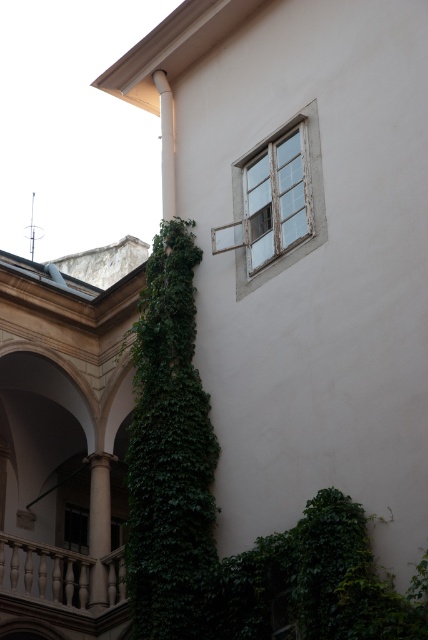
Between green leafy ivy at left and white marble balustrade at lower left, which one is positioned lower?

Positioned lower is white marble balustrade at lower left.

Can you confirm if green leafy ivy at left is shorter than white marble balustrade at lower left?

In fact, green leafy ivy at left may be taller than white marble balustrade at lower left.

Identify the location of green leafy ivy at left. (169, 454).

Can you confirm if green leafy ivy at left is taller than smooth stone column at lower left?

Indeed, green leafy ivy at left has a greater height compared to smooth stone column at lower left.

Can you confirm if green leafy ivy at left is positioned to the right of smooth stone column at lower left?

Indeed, green leafy ivy at left is positioned on the right side of smooth stone column at lower left.

Locate an element on the screen. The width and height of the screenshot is (428, 640). green leafy ivy at left is located at coordinates (169, 454).

In the scene shown: Is green leafy ivy at lower right taller than smooth stone column at lower left?

No.

Who is positioned more to the right, green leafy ivy at lower right or smooth stone column at lower left?

Positioned to the right is green leafy ivy at lower right.

What do you see at coordinates (315, 582) in the screenshot?
I see `green leafy ivy at lower right` at bounding box center [315, 582].

This screenshot has height=640, width=428. What are the coordinates of `green leafy ivy at lower right` in the screenshot? It's located at (315, 582).